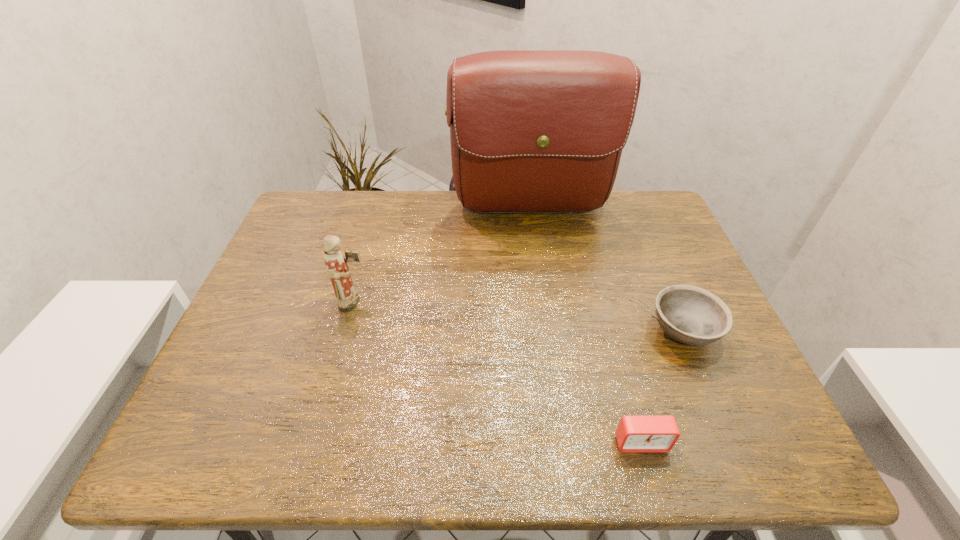
Where is `free space between the tallest object and the second tallest object`? The width and height of the screenshot is (960, 540). free space between the tallest object and the second tallest object is located at coordinates (443, 257).

At what (x,y) coordinates should I click in order to perform the action: click on vacant point located between the bowl and the farthest object. Please return your answer as a coordinate pair (x, y). This screenshot has width=960, height=540. Looking at the image, I should click on (607, 272).

Where is `free space between the nearest object and the farthest object`? The width and height of the screenshot is (960, 540). free space between the nearest object and the farthest object is located at coordinates (586, 327).

Find the location of `vacant point located between the nearest object and the tallest object`. vacant point located between the nearest object and the tallest object is located at coordinates (586, 327).

Image resolution: width=960 pixels, height=540 pixels. I want to click on blank region between the alarm clock and the bowl, so click(661, 387).

You are a GUI agent. You are given a task and a screenshot of the screen. Output one action in this format:
    pyautogui.click(x=<x>, y=<y>)
    Task: Click on the vacant area that lies between the nearest object and the third shortest object
    
    Given the screenshot: What is the action you would take?
    pyautogui.click(x=497, y=373)

The height and width of the screenshot is (540, 960). Identify the location of vacant region between the nearest object and the third shortest object. (497, 373).

This screenshot has height=540, width=960. Identify the location of unoccupied area between the bowl and the nearest object. (661, 387).

Where is `free space that is in between the bowl and the alarm clock`? free space that is in between the bowl and the alarm clock is located at coordinates (661, 387).

Select which object appears as the third closest to the alarm clock. Please provide its 2D coordinates. Your answer should be formatted as a tuple, i.e. [(x, y)], where the tuple contains the x and y coordinates of a point satisfying the conditions above.

[(336, 265)]